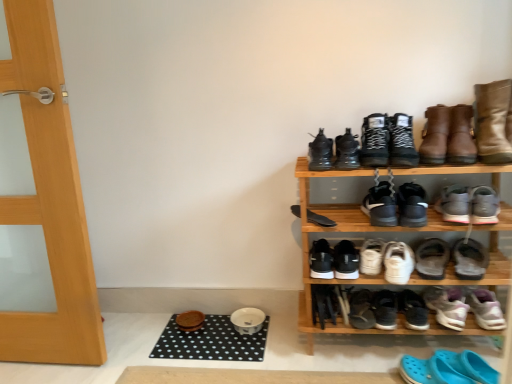
This screenshot has width=512, height=384. What are the coordinates of `empty space that is ontop of black dotted mat at lower center, the first doormat in the back-to-front sequence (from a real-world perspective)` in the screenshot? It's located at (212, 327).